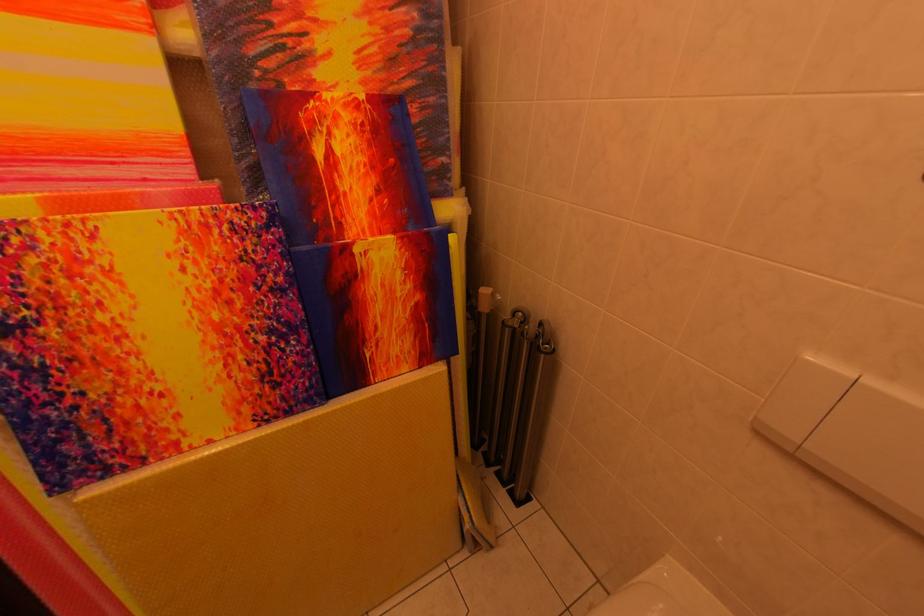
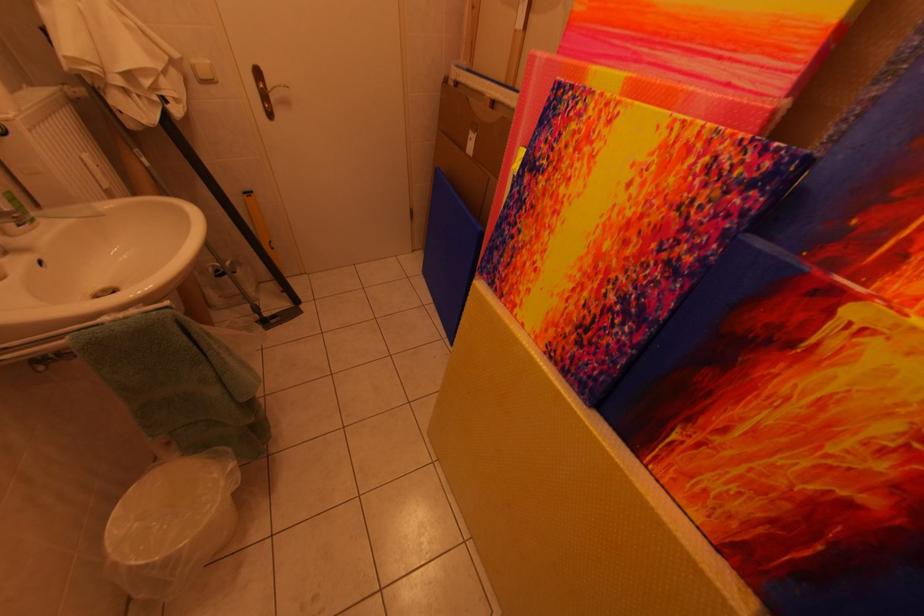
Locate, in the second image, the point that corresponds to point (81, 315) in the first image.

(565, 180)